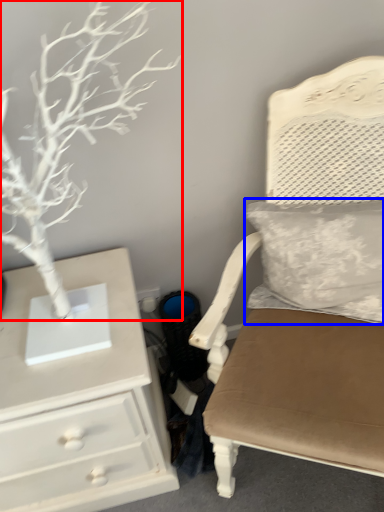
Question: Which object is closer to the camera taking this photo, tree (highlighted by a red box) or pillow (highlighted by a blue box)?

Choices:
 (A) tree
 (B) pillow

Answer: (A)